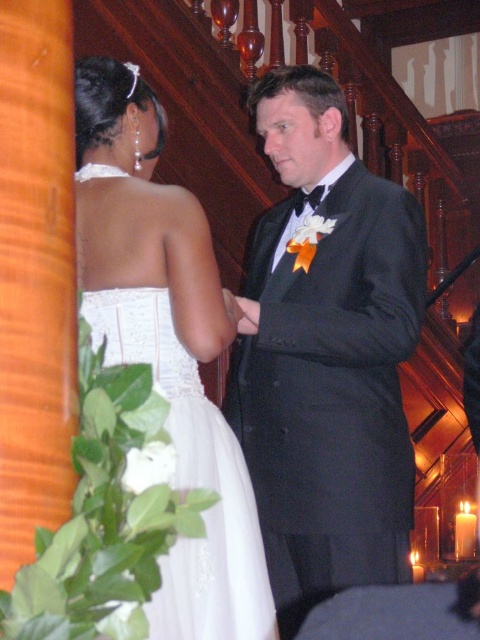
You are a photographer at the wedding and need to adjust the camera focus. Since the black satin tuxedo at center and the white satin dress at center are both in the frame, which one should you focus on first if you want to ensure the larger object is sharp?

The black satin tuxedo at center has a larger size compared to the white satin dress at center, so you should focus on the black satin tuxedo at center first to ensure the larger object is sharp.

You are a photographer at a wedding and need to position the couple so that the black satin tuxedo at center and the white satin dress at center are aligned symmetrically. Based on their current positions, which direction should the groom move to achieve symmetry?

The black satin tuxedo at center is currently to the right of the white satin dress at center. To align them symmetrically, the groom should move to the left so that the black satin tuxedo at center is positioned directly opposite the white satin dress at center.

You are a photographer positioned at the back of the room, aiming to capture both the black satin tuxedo at center and the white satin dress at center in a single shot. Which of the two will appear closer to the camera in your photo?

The black satin tuxedo at center will appear closer to the camera because it is positioned further to the viewer than the white satin dress at center.